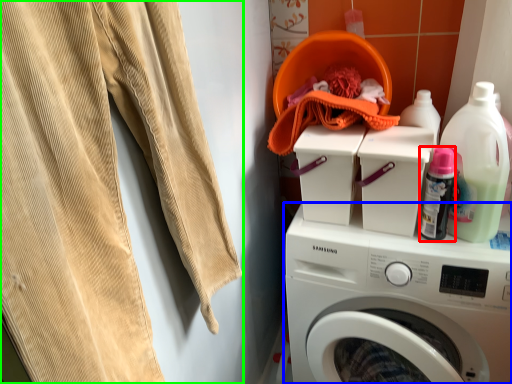
Question: Considering the real-world distances, which object is closest to bottle (highlighted by a red box)? washing machine (highlighted by a blue box) or sweat pant (highlighted by a green box).

Choices:
 (A) washing machine
 (B) sweat pant

Answer: (A)